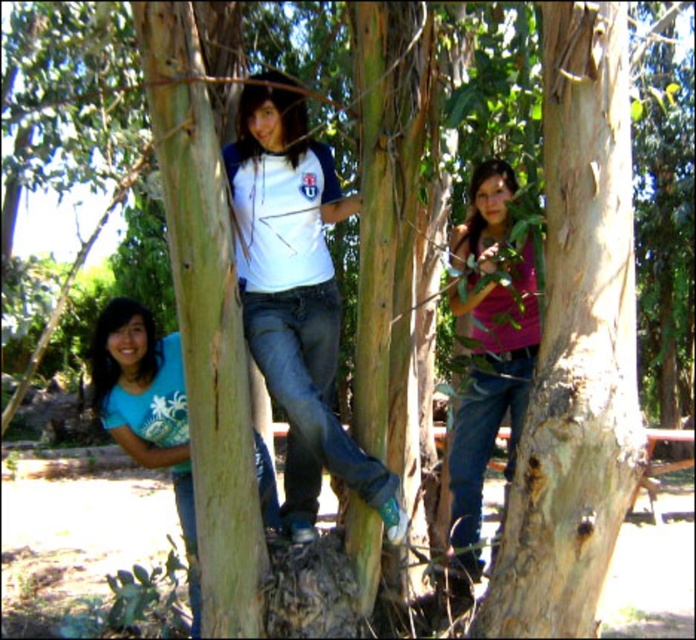
Question: From the image, what is the correct spatial relationship of pink matte shirt at center in relation to blue denim jeans at lower left?

Choices:
 (A) below
 (B) above

Answer: (B)

Question: Can you confirm if pink matte shirt at center is positioned to the right of blue denim jeans at lower left?

Choices:
 (A) yes
 (B) no

Answer: (A)

Question: Which object appears closest to the camera in this image?

Choices:
 (A) blue denim jeans at lower left
 (B) pink matte shirt at center

Answer: (B)

Question: Is pink matte shirt at center further to camera compared to blue denim jeans at lower left?

Choices:
 (A) yes
 (B) no

Answer: (B)

Question: Which object appears farthest from the camera in this image?

Choices:
 (A) blue denim jeans at lower left
 (B) pink matte shirt at center

Answer: (A)

Question: Which object is farther from the camera taking this photo?

Choices:
 (A) pink matte shirt at center
 (B) blue denim jeans at lower left

Answer: (B)